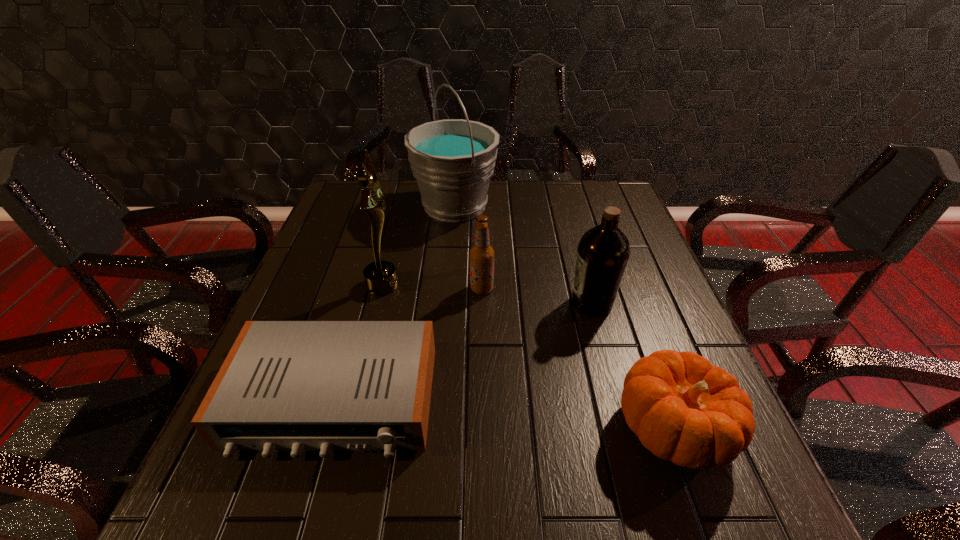
This screenshot has width=960, height=540. I want to click on vacant position located 0.180m on the label of the olive oil, so click(x=493, y=303).

I want to click on free space located on the front label of the beer bottle, so click(394, 288).

The width and height of the screenshot is (960, 540). I want to click on free space located 0.370m on the front label of the beer bottle, so click(x=321, y=288).

Locate an element on the screen. Image resolution: width=960 pixels, height=540 pixels. vacant space located 0.160m on the front label of the beer bottle is located at coordinates (405, 288).

The image size is (960, 540). What are the coordinates of `vacant space located 0.390m on the back of the pumpkin` in the screenshot? It's located at click(612, 261).

The width and height of the screenshot is (960, 540). What are the coordinates of `blank space located 0.100m on the control panel of the shortest object` in the screenshot? It's located at click(x=298, y=523).

In order to click on object that is at the far edge in this screenshot , I will do `click(452, 160)`.

Locate an element on the screen. This screenshot has height=540, width=960. object at the near edge is located at coordinates (684, 410).

What are the coordinates of `object that is at the left edge` in the screenshot? It's located at (296, 386).

This screenshot has width=960, height=540. In order to click on olive oil that is at the right edge in this screenshot , I will do `click(603, 252)`.